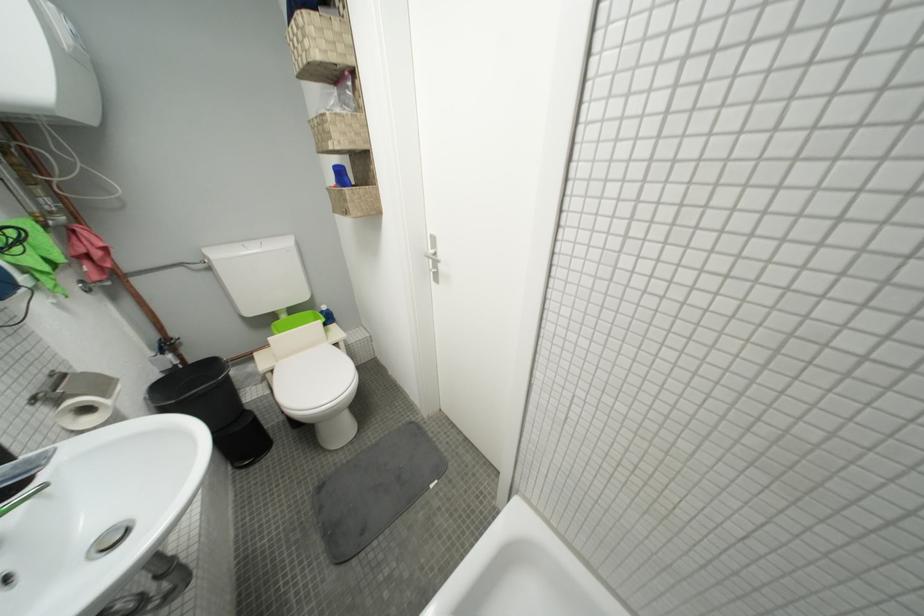
What do you see at coordinates (110, 539) in the screenshot? I see `the silver faucet handle` at bounding box center [110, 539].